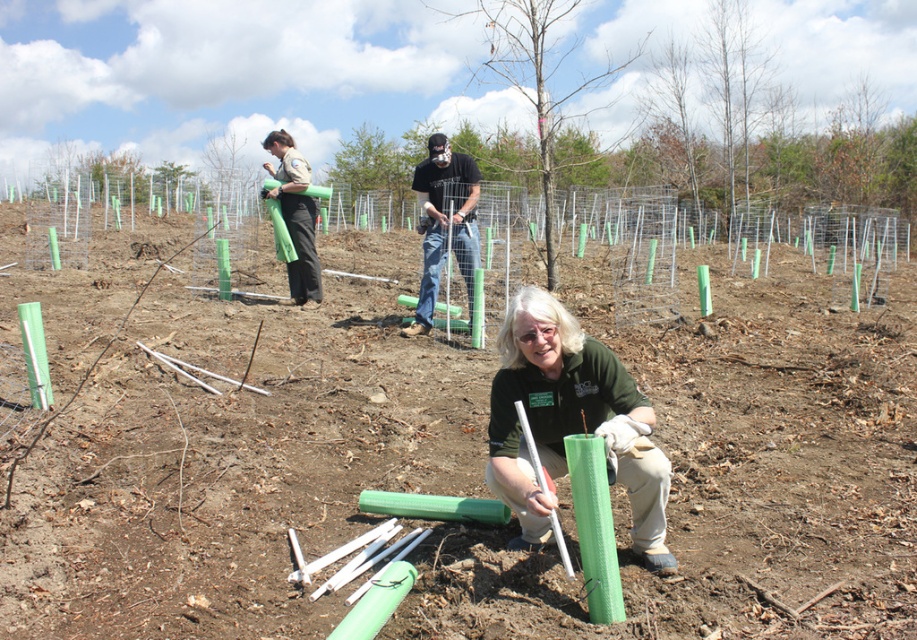
Based on the photo, you are standing at the origin point of the coordinate system. You want to walk to the black matte shirt at center. Which direction should you walk?

The black matte shirt at center is located at coordinates point (445, 221), so you should walk northeast to reach it.

You are a park ranger who needs to place a 60 feet long fence between the smooth bark tree at center and the black matte shirt at center. Can you fit the fence between them?

The distance between the smooth bark tree at center and the black matte shirt at center is 57.61 feet, which is shorter than the 60 feet fence. Therefore, the fence cannot be placed between them as it would exceed the available space.